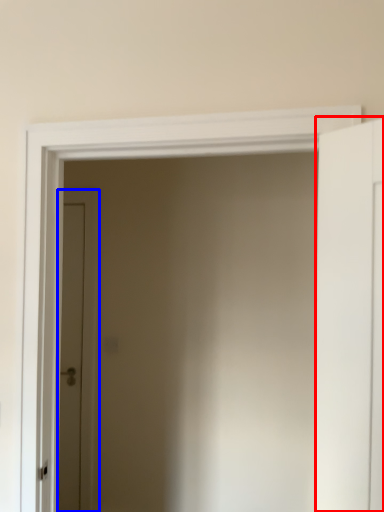
Question: Which object appears farthest to the camera in this image, door (highlighted by a red box) or door (highlighted by a blue box)?

Choices:
 (A) door
 (B) door

Answer: (B)